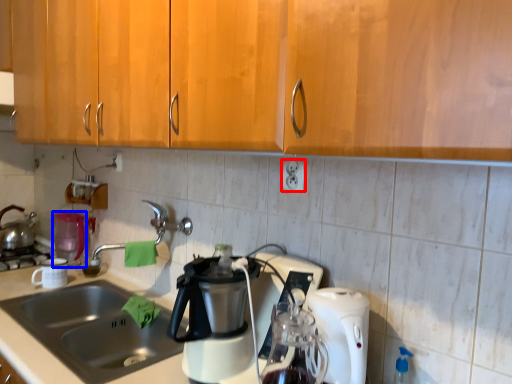
Question: Which point is closer to the camera, electric outlet (highlighted by a red box) or appliance (highlighted by a blue box)?

Choices:
 (A) electric outlet
 (B) appliance

Answer: (A)